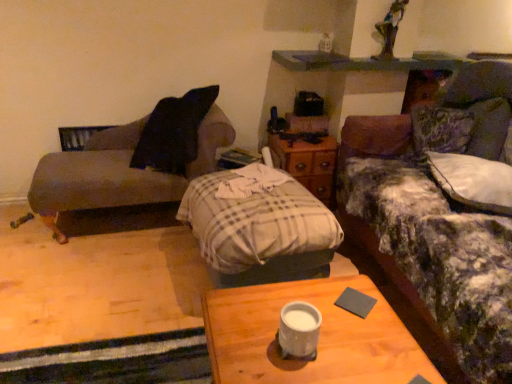
Identify the location of free point behind white matte coffee cup at center. (291, 299).